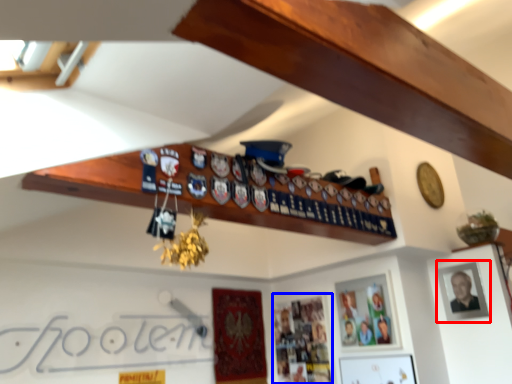
Question: Which object appears farthest to the camera in this image, picture frame (highlighted by a red box) or picture frame (highlighted by a blue box)?

Choices:
 (A) picture frame
 (B) picture frame

Answer: (B)